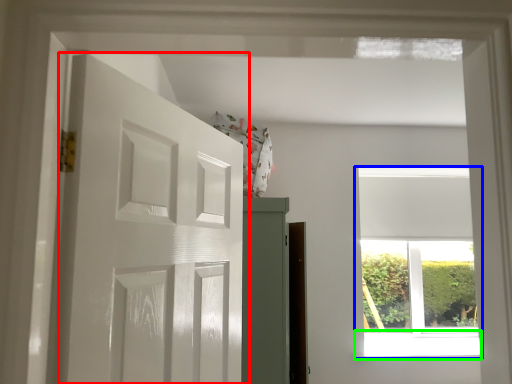
Question: Which object is positioned farthest from door (highlighted by a red box)? Select from window (highlighted by a blue box) and window sill (highlighted by a green box).

Choices:
 (A) window
 (B) window sill

Answer: (A)